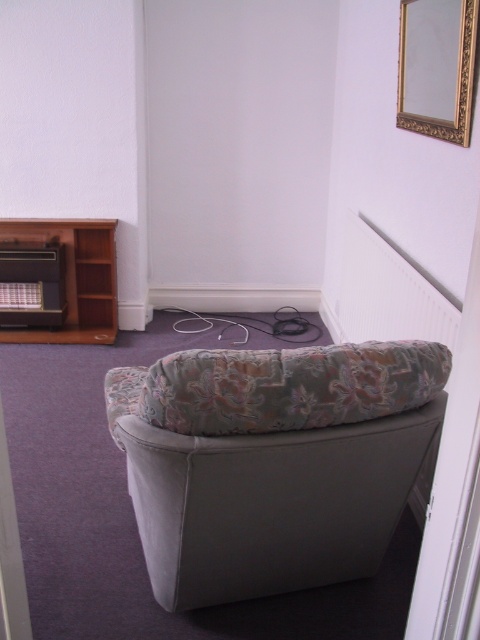
Question: Considering the relative positions of suede-patterned armchair at center and brown wooden bookshelf at left in the image provided, where is suede-patterned armchair at center located with respect to brown wooden bookshelf at left?

Choices:
 (A) right
 (B) left

Answer: (A)

Question: Which of the following is the closest to the observer?

Choices:
 (A) (442, 77)
 (B) (4, 244)
 (C) (301, 358)
 (D) (205, 468)

Answer: (D)

Question: Does floral fabric pillow at center have a smaller size compared to gold ornate picture frame at upper right?

Choices:
 (A) yes
 (B) no

Answer: (A)

Question: Among these points, which one is farthest from the camera?

Choices:
 (A) (346, 358)
 (B) (432, 120)
 (C) (348, 481)

Answer: (B)

Question: Which object appears closest to the camera in this image?

Choices:
 (A) suede-patterned armchair at center
 (B) floral fabric pillow at center
 (C) gold ornate picture frame at upper right
 (D) brown wooden bookshelf at left

Answer: (A)

Question: Does gold ornate picture frame at upper right have a larger size compared to brown wooden bookshelf at left?

Choices:
 (A) no
 (B) yes

Answer: (A)